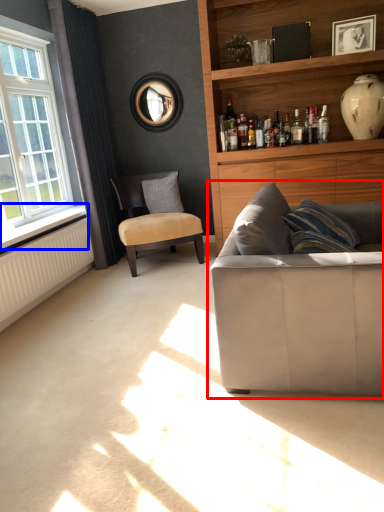
Question: Which object appears farthest to the camera in this image, studio couch (highlighted by a red box) or window sill (highlighted by a blue box)?

Choices:
 (A) studio couch
 (B) window sill

Answer: (B)